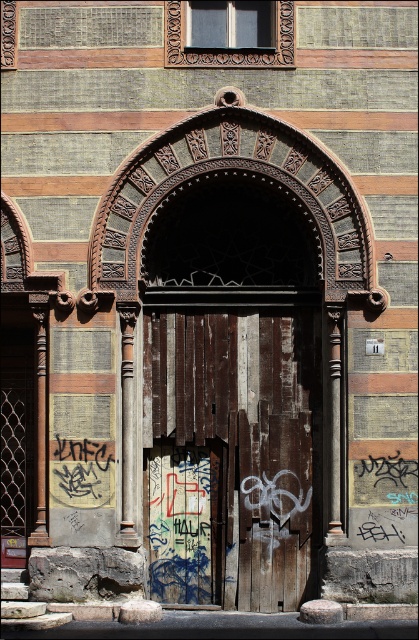
Can you confirm if weathered wood door at center is taller than grungy wooden door at center?

Incorrect, weathered wood door at center's height is not larger of grungy wooden door at center's.

Between weathered wood door at center and grungy wooden door at center, which one is positioned lower?

weathered wood door at center is lower down.

Which is behind, point (196, 333) or point (196, 499)?

The point (196, 333) is more distant.

Identify the location of weathered wood door at center. This screenshot has width=419, height=640. (230, 452).